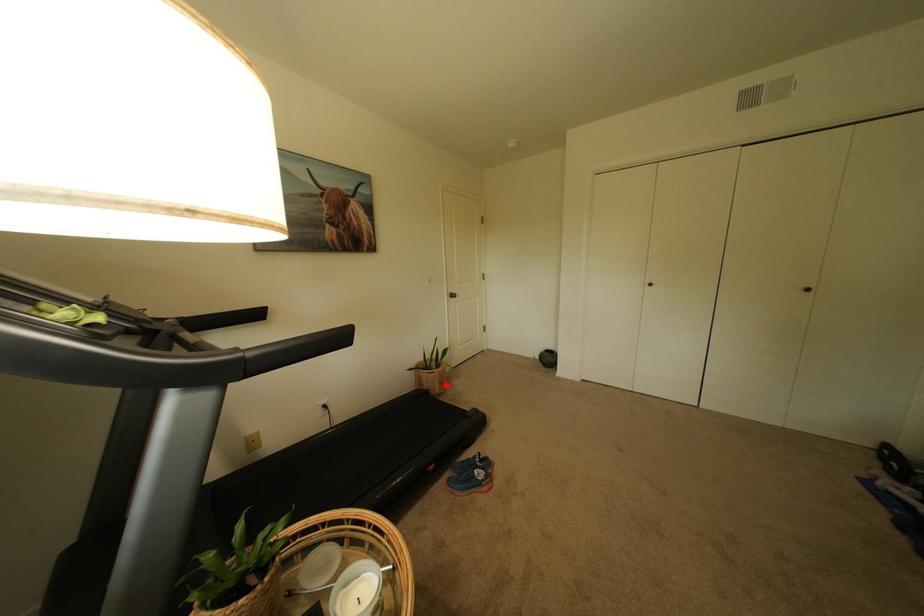
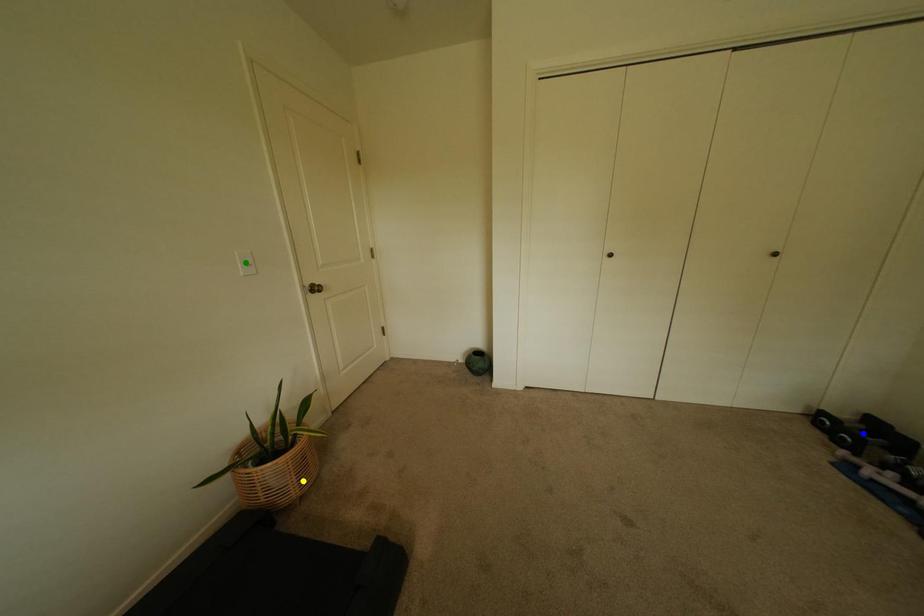
Question: I am providing you with two images of the same scene from different viewpoints. A red point is marked on the first image. You are given multiple points on the second image. Which mark in image 2 goes with the point in image 1?

Choices:
 (A) green point
 (B) yellow point
 (C) blue point

Answer: (B)